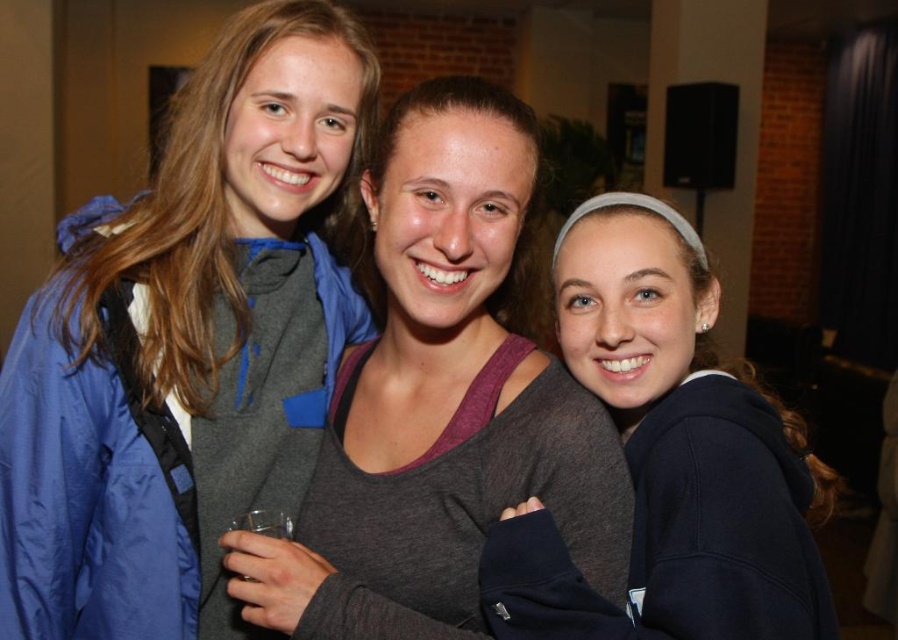
Question: Can you confirm if matte gray hoodie at center is positioned above dark blue sweatshirt at center?

Choices:
 (A) no
 (B) yes

Answer: (B)

Question: Is the position of matte gray hoodie at center more distant than that of dark blue sweatshirt at center?

Choices:
 (A) no
 (B) yes

Answer: (B)

Question: Can you confirm if matte gray hoodie at center is positioned below dark blue sweatshirt at center?

Choices:
 (A) yes
 (B) no

Answer: (B)

Question: Which of the following is the farthest from the observer?

Choices:
 (A) dark blue sweatshirt at center
 (B) gray matte tank top at center
 (C) matte gray hoodie at center

Answer: (C)

Question: Which point appears closest to the camera in this image?

Choices:
 (A) (724, 401)
 (B) (568, 388)

Answer: (A)

Question: Which of the following is the farthest from the observer?

Choices:
 (A) (671, 324)
 (B) (59, 438)

Answer: (A)